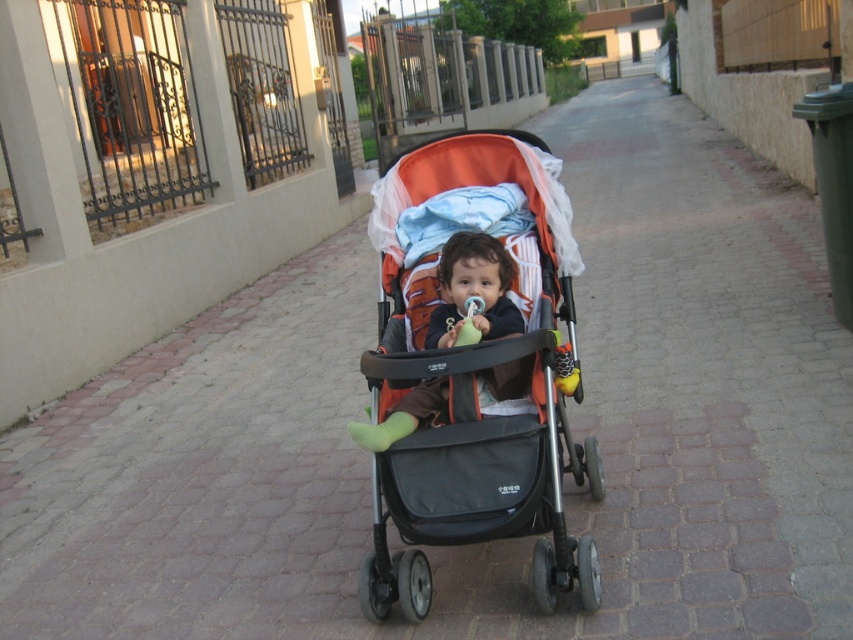
Question: Is orange fabric baby carriage at center in front of soft orange fabric stroller at center?

Choices:
 (A) yes
 (B) no

Answer: (A)

Question: Which of the following is the closest to the observer?

Choices:
 (A) orange fabric baby carriage at center
 (B) soft orange fabric stroller at center

Answer: (A)

Question: Does orange fabric baby carriage at center appear under soft orange fabric stroller at center?

Choices:
 (A) no
 (B) yes

Answer: (B)

Question: Which of the following is the closest to the observer?

Choices:
 (A) (370, 428)
 (B) (556, 333)

Answer: (A)

Question: Which point is farther to the camera?

Choices:
 (A) soft orange fabric stroller at center
 (B) orange fabric baby carriage at center

Answer: (A)

Question: Where is orange fabric baby carriage at center located in relation to soft orange fabric stroller at center in the image?

Choices:
 (A) above
 (B) below

Answer: (B)